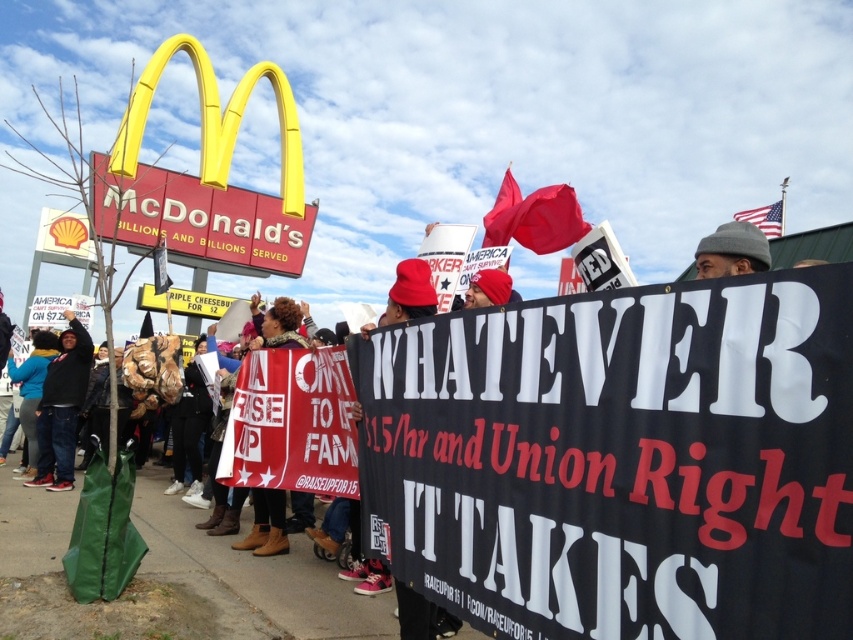
Is dark blue jeans at lower left positioned in front of matte red flag at upper center?

That is False.

Who is more forward, (44, 396) or (490, 228)?

Point (490, 228) is in front.

Find the location of `dark blue jeans at lower left`. dark blue jeans at lower left is located at coordinates (62, 406).

Looking at this image, between dark blue jeans at lower left and american flag at upper right, which one appears on the left side from the viewer's perspective?

Positioned to the left is dark blue jeans at lower left.

Does dark blue jeans at lower left appear on the left side of american flag at upper right?

Yes, dark blue jeans at lower left is to the left of american flag at upper right.

Does point (45, 440) come behind point (782, 204)?

No, it is in front of (782, 204).

Locate an element on the screen. This screenshot has height=640, width=853. dark blue jeans at lower left is located at coordinates (62, 406).

Consider the image. Which of these two, black fabric banner at center or red fabric flag at upper center, stands shorter?

With less height is black fabric banner at center.

Is point (729, 292) farther from camera compared to point (506, 198)?

No, (729, 292) is in front of (506, 198).

Which is behind, point (486, 497) or point (511, 180)?

Point (511, 180)

At what (x,y) coordinates should I click in order to perform the action: click on black fabric banner at center. Please return your answer as a coordinate pair (x, y). Image resolution: width=853 pixels, height=640 pixels. Looking at the image, I should click on (621, 460).